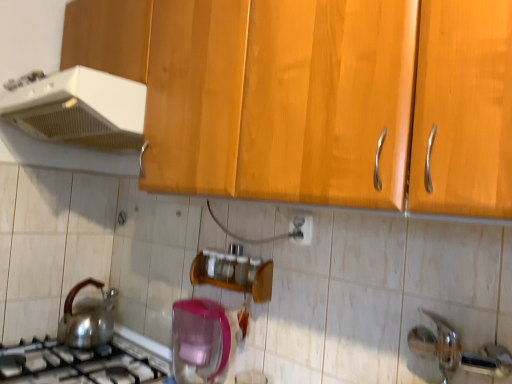
Locate an element on the screen. white glossy electric outlet at center is located at coordinates (301, 229).

The width and height of the screenshot is (512, 384). What do you see at coordinates (199, 340) in the screenshot?
I see `translucent plastic container at lower center, the third kitchen appliance viewed from the top` at bounding box center [199, 340].

Identify the location of white plastic range hood at upper left, which is counted as the 3th kitchen appliance, starting from the bottom. This screenshot has width=512, height=384. (80, 109).

Is white plastic range hood at upper left, arranged as the first kitchen appliance when viewed from the top, not close to shiny metallic kettle at lower left, which is the second kitchen appliance from top to bottom?

They are positioned close to each other.

Between white plastic range hood at upper left, which is counted as the 3th kitchen appliance, starting from the bottom, and shiny metallic kettle at lower left, which is the second kitchen appliance from top to bottom, which one is positioned behind?

shiny metallic kettle at lower left, which is the second kitchen appliance from top to bottom, is further from the camera.

From a real-world perspective, is white plastic range hood at upper left, arranged as the first kitchen appliance when viewed from the top, located beneath shiny metallic kettle at lower left, which is the second kitchen appliance from top to bottom?

Incorrect, from a real-world perspective, white plastic range hood at upper left, arranged as the first kitchen appliance when viewed from the top, is higher than shiny metallic kettle at lower left, which is the second kitchen appliance from top to bottom.

Which of these two, white glossy electric outlet at center or satin silver gas stove at lower left, is thinner?

white glossy electric outlet at center is thinner.

Where is `gas stove below the white glossy electric outlet at center (from the image's perspective)`? This screenshot has height=384, width=512. gas stove below the white glossy electric outlet at center (from the image's perspective) is located at coordinates (80, 363).

What's the angular difference between white glossy electric outlet at center and satin silver gas stove at lower left's facing directions?

0.00775 degrees.

Could you tell me if white glossy electric outlet at center is turned towards satin silver gas stove at lower left?

No.

Considering the positions of point (266, 299) and point (186, 351), is point (266, 299) closer or farther from the camera than point (186, 351)?

Point (266, 299) appears to be closer to the viewer than point (186, 351).

In the image, there is a translucent plastic container at lower center, which ranks as the first kitchen appliance in bottom-to-top order. Where is `shelf above it (from the image's perspective)`? shelf above it (from the image's perspective) is located at coordinates (237, 284).

Is wooden spice rack at center in front of translucent plastic container at lower center, the third kitchen appliance viewed from the top?

No.

From the image's perspective, who appears lower, wooden spice rack at center or shiny metallic kettle at lower left, placed as the 2th kitchen appliance when sorted from bottom to top?

shiny metallic kettle at lower left, placed as the 2th kitchen appliance when sorted from bottom to top, is shown below in the image.

Is wooden spice rack at center touching shiny metallic kettle at lower left, which is the second kitchen appliance from top to bottom?

There is a gap between wooden spice rack at center and shiny metallic kettle at lower left, which is the second kitchen appliance from top to bottom.

Find the location of a particular element. shelf located in front of the shiny metallic kettle at lower left, placed as the 2th kitchen appliance when sorted from bottom to top is located at coordinates (237, 284).

Considering the sizes of objects wooden spice rack at center and shiny metallic kettle at lower left, which is the second kitchen appliance from top to bottom, in the image provided, who is bigger, wooden spice rack at center or shiny metallic kettle at lower left, which is the second kitchen appliance from top to bottom,?

Bigger between the two is shiny metallic kettle at lower left, which is the second kitchen appliance from top to bottom.

Which object is positioned more to the right, satin silver gas stove at lower left or shiny metallic kettle at lower left, which is the second kitchen appliance from top to bottom?

Positioned to the right is satin silver gas stove at lower left.

From their relative heights in the image, would you say satin silver gas stove at lower left is taller or shorter than shiny metallic kettle at lower left, which is the second kitchen appliance from top to bottom?

satin silver gas stove at lower left is shorter than shiny metallic kettle at lower left, which is the second kitchen appliance from top to bottom.

Is satin silver gas stove at lower left next to shiny metallic kettle at lower left, placed as the 2th kitchen appliance when sorted from bottom to top, and touching it?

They are not placed beside each other.

Based on the photo, which of these two, satin silver gas stove at lower left or shiny metallic kettle at lower left, placed as the 2th kitchen appliance when sorted from bottom to top, is thinner?

Thinner between the two is shiny metallic kettle at lower left, placed as the 2th kitchen appliance when sorted from bottom to top.

Which is behind, satin silver gas stove at lower left or wooden spice rack at center?

wooden spice rack at center is behind.

Which object is positioned more to the right, satin silver gas stove at lower left or wooden spice rack at center?

wooden spice rack at center.

How different are the orientations of satin silver gas stove at lower left and wooden spice rack at center in degrees?

The angle between the facing direction of satin silver gas stove at lower left and the facing direction of wooden spice rack at center is 0.00219 degrees.

Locate an element on the screen. Image resolution: width=512 pixels, height=384 pixels. shelf located behind the satin silver gas stove at lower left is located at coordinates (237, 284).

Considering the relative sizes of satin silver gas stove at lower left and translucent plastic container at lower center, which ranks as the first kitchen appliance in bottom-to-top order, in the image provided, is satin silver gas stove at lower left wider than translucent plastic container at lower center, which ranks as the first kitchen appliance in bottom-to-top order,?

Correct, the width of satin silver gas stove at lower left exceeds that of translucent plastic container at lower center, which ranks as the first kitchen appliance in bottom-to-top order.

Which object is further away from the camera, satin silver gas stove at lower left or translucent plastic container at lower center, which ranks as the first kitchen appliance in bottom-to-top order?

translucent plastic container at lower center, which ranks as the first kitchen appliance in bottom-to-top order, is further from the camera.

Considering the sizes of objects satin silver gas stove at lower left and translucent plastic container at lower center, the third kitchen appliance viewed from the top, in the image provided, who is smaller, satin silver gas stove at lower left or translucent plastic container at lower center, the third kitchen appliance viewed from the top,?

With smaller size is translucent plastic container at lower center, the third kitchen appliance viewed from the top.

Are satin silver gas stove at lower left and translucent plastic container at lower center, which ranks as the first kitchen appliance in bottom-to-top order, far apart?

No, satin silver gas stove at lower left is not far away from translucent plastic container at lower center, which ranks as the first kitchen appliance in bottom-to-top order.

In the image, there is a shiny metallic kettle at lower left, placed as the 2th kitchen appliance when sorted from bottom to top. At what (x,y) coordinates should I click in order to perform the action: click on kitchen appliance above it (from the image's perspective). Please return your answer as a coordinate pair (x, y). Image resolution: width=512 pixels, height=384 pixels. Looking at the image, I should click on (80, 109).

The image size is (512, 384). I want to click on electric outlet that appears on the right of satin silver gas stove at lower left, so click(301, 229).

Considering their positions, is translucent plastic container at lower center, which ranks as the first kitchen appliance in bottom-to-top order, positioned further to white glossy electric outlet at center than satin silver gas stove at lower left?

satin silver gas stove at lower left is positioned further to the anchor white glossy electric outlet at center.

Estimate the real-world distances between objects in this image. Which object is closer to translucent plastic container at lower center, the third kitchen appliance viewed from the top, shiny metallic kettle at lower left, which is the second kitchen appliance from top to bottom, or satin silver gas stove at lower left?

satin silver gas stove at lower left.

Looking at the image, which one is located further to white glossy electric outlet at center, translucent plastic container at lower center, the third kitchen appliance viewed from the top, or wooden spice rack at center?

translucent plastic container at lower center, the third kitchen appliance viewed from the top, is further to white glossy electric outlet at center.

Based on their spatial positions, is white glossy electric outlet at center or shiny metallic kettle at lower left, which is the second kitchen appliance from top to bottom, closer to satin silver gas stove at lower left?

Based on the image, shiny metallic kettle at lower left, which is the second kitchen appliance from top to bottom, appears to be nearer to satin silver gas stove at lower left.

From the picture: Looking at the image, which one is located closer to white glossy electric outlet at center, white plastic range hood at upper left, which is counted as the 3th kitchen appliance, starting from the bottom, or shiny metallic kettle at lower left, placed as the 2th kitchen appliance when sorted from bottom to top?

white plastic range hood at upper left, which is counted as the 3th kitchen appliance, starting from the bottom, lies closer to white glossy electric outlet at center than the other object.

Looking at the image, which one is located closer to white plastic range hood at upper left, arranged as the first kitchen appliance when viewed from the top, shiny metallic kettle at lower left, which is the second kitchen appliance from top to bottom, or translucent plastic container at lower center, the third kitchen appliance viewed from the top?

translucent plastic container at lower center, the third kitchen appliance viewed from the top.

Which object lies further to the anchor point white glossy electric outlet at center, satin silver gas stove at lower left or shiny metallic kettle at lower left, placed as the 2th kitchen appliance when sorted from bottom to top?

Among the two, shiny metallic kettle at lower left, placed as the 2th kitchen appliance when sorted from bottom to top, is located further to white glossy electric outlet at center.

Which object lies nearer to the anchor point satin silver gas stove at lower left, wooden spice rack at center or translucent plastic container at lower center, the third kitchen appliance viewed from the top?

translucent plastic container at lower center, the third kitchen appliance viewed from the top, is closer to satin silver gas stove at lower left.

The width and height of the screenshot is (512, 384). I want to click on shelf between white plastic range hood at upper left, arranged as the first kitchen appliance when viewed from the top, and white glossy electric outlet at center from left to right, so click(x=237, y=284).

Locate an element on the screen. Image resolution: width=512 pixels, height=384 pixels. shelf between white plastic range hood at upper left, which is counted as the 3th kitchen appliance, starting from the bottom, and satin silver gas stove at lower left from top to bottom is located at coordinates (237, 284).

Image resolution: width=512 pixels, height=384 pixels. What are the coordinates of `kitchen appliance between white plastic range hood at upper left, arranged as the first kitchen appliance when viewed from the top, and translucent plastic container at lower center, the third kitchen appliance viewed from the top, vertically` in the screenshot? It's located at (87, 318).

The height and width of the screenshot is (384, 512). What are the coordinates of `gas stove between shiny metallic kettle at lower left, placed as the 2th kitchen appliance when sorted from bottom to top, and translucent plastic container at lower center, the third kitchen appliance viewed from the top, in the horizontal direction` in the screenshot? It's located at (80, 363).